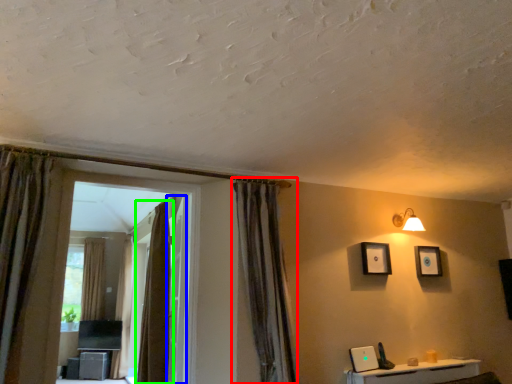
Question: Which is nearer to the curtain (highlighted by a red box)? screen door (highlighted by a blue box) or curtain (highlighted by a green box).

Choices:
 (A) screen door
 (B) curtain

Answer: (A)